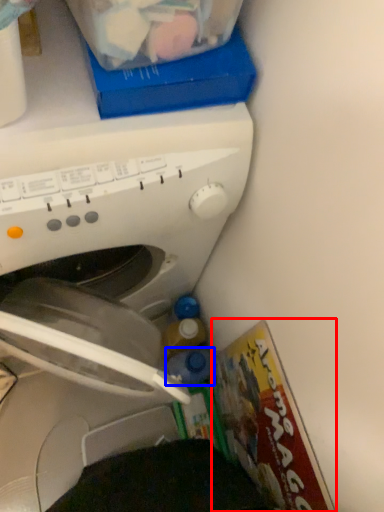
Question: Which of the following is the closest to the observer, magazine (highlighted by a red box) or bottle (highlighted by a blue box)?

Choices:
 (A) magazine
 (B) bottle

Answer: (A)